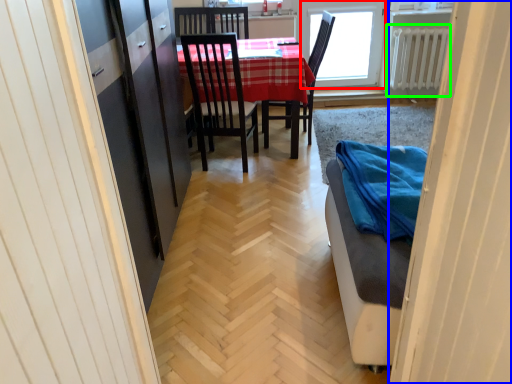
Question: Which object is the farthest from window (highlighted by a red box)? Choose among these: door (highlighted by a blue box) or radiator (highlighted by a green box).

Choices:
 (A) door
 (B) radiator

Answer: (A)